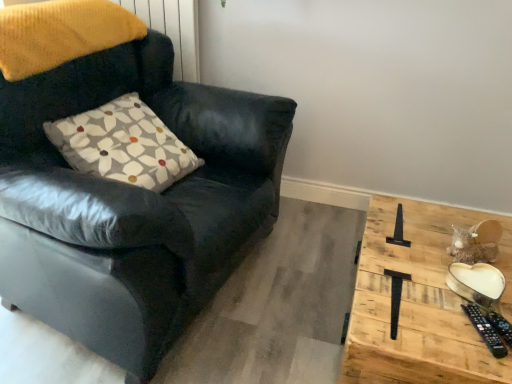
Question: In the image, is white printed cushion at upper left on the left side or the right side of wooden heart-shaped plate at right?

Choices:
 (A) left
 (B) right

Answer: (A)

Question: Is white printed cushion at upper left taller or shorter than wooden heart-shaped plate at right?

Choices:
 (A) short
 (B) tall

Answer: (A)

Question: Based on their relative distances, which object is nearer to the white printed cushion at upper left?

Choices:
 (A) matte black armchair at left
 (B) wooden heart-shaped plate at right

Answer: (A)

Question: Estimate the real-world distances between objects in this image. Which object is closer to the white printed cushion at upper left?

Choices:
 (A) wooden heart-shaped plate at right
 (B) matte black armchair at left

Answer: (B)